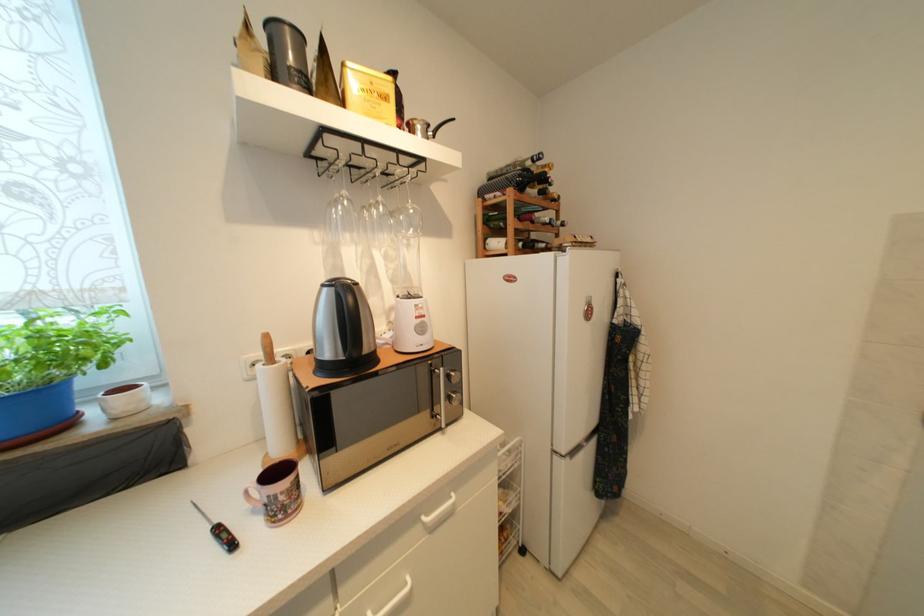
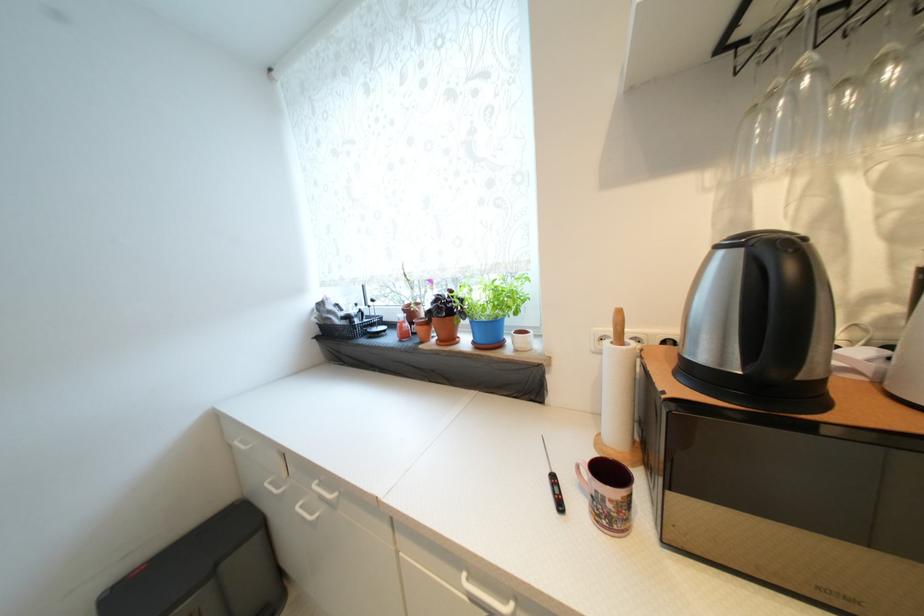
Locate, in the second image, the point that corresponds to pixel 356 302 in the first image.

(796, 270)